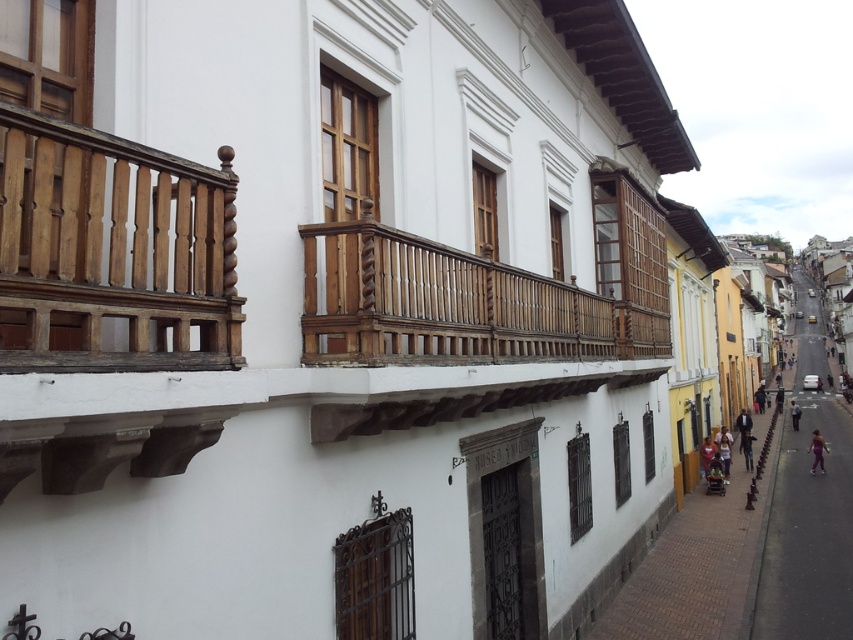
Who is more distant from viewer, (22,294) or (756,598)?

The point (756,598) is behind.

Does wooden polished balcony at upper left have a greater width compared to asphalt road at lower right?

In fact, wooden polished balcony at upper left might be narrower than asphalt road at lower right.

In the scene shown: Measure the distance between wooden polished balcony at upper left and camera.

9.31 feet

The height and width of the screenshot is (640, 853). Identify the location of wooden polished balcony at upper left. click(x=112, y=252).

Is wooden at center smaller than asphalt road at lower right?

Yes, wooden at center is smaller than asphalt road at lower right.

Where is `wooden at center`? This screenshot has height=640, width=853. wooden at center is located at coordinates (436, 304).

Between point (403, 339) and point (828, 490), which one is positioned in front?

Positioned in front is point (403, 339).

The height and width of the screenshot is (640, 853). I want to click on wooden at center, so click(x=436, y=304).

Is purple fabric pants at lower right bigger than light blue jeans at lower right?

No.

Does point (819, 460) come closer to viewer compared to point (796, 403)?

Yes, it is.

You are a GUI agent. You are given a task and a screenshot of the screen. Output one action in this format:
    pyautogui.click(x=<x>, y=<y>)
    Task: Click on the purple fabric pants at lower right
    This screenshot has height=640, width=853.
    Given the screenshot: What is the action you would take?
    [817, 451]